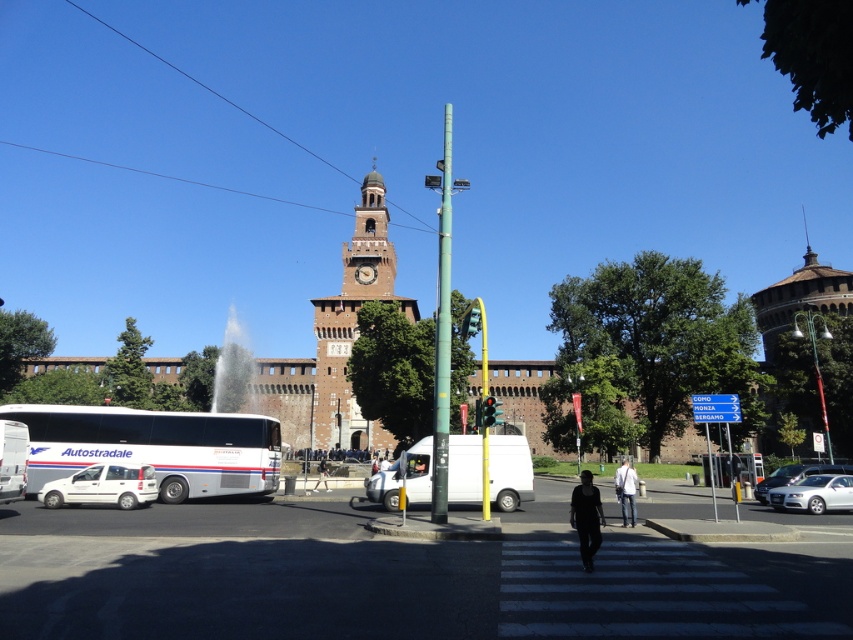
Question: Which object is the closest to the silver metallic sedan at lower right?

Choices:
 (A) dark gray fabric jacket at center
 (B) black fabric person at center

Answer: (A)

Question: Is green metallic pole at center to the right of black fabric person at center from the viewer's perspective?

Choices:
 (A) yes
 (B) no

Answer: (A)

Question: Is white glossy bus at lower left wider than white cotton shirt at center?

Choices:
 (A) yes
 (B) no

Answer: (A)

Question: Does white glossy bus at lower left appear under silver metallic sedan at lower right?

Choices:
 (A) yes
 (B) no

Answer: (B)

Question: Which object appears farthest from the camera in this image?

Choices:
 (A) brown brick clock tower at center
 (B) white matte van at center

Answer: (A)

Question: Which point is farther from the camera taking this photo?

Choices:
 (A) 315,433
 (B) 318,465
 (C) 146,429

Answer: (A)